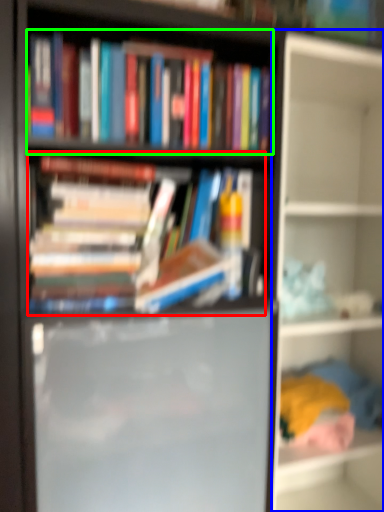
Question: Which object is the closest to the book (highlighted by a red box)? Choose among these: shelf (highlighted by a blue box) or book (highlighted by a green box).

Choices:
 (A) shelf
 (B) book

Answer: (B)